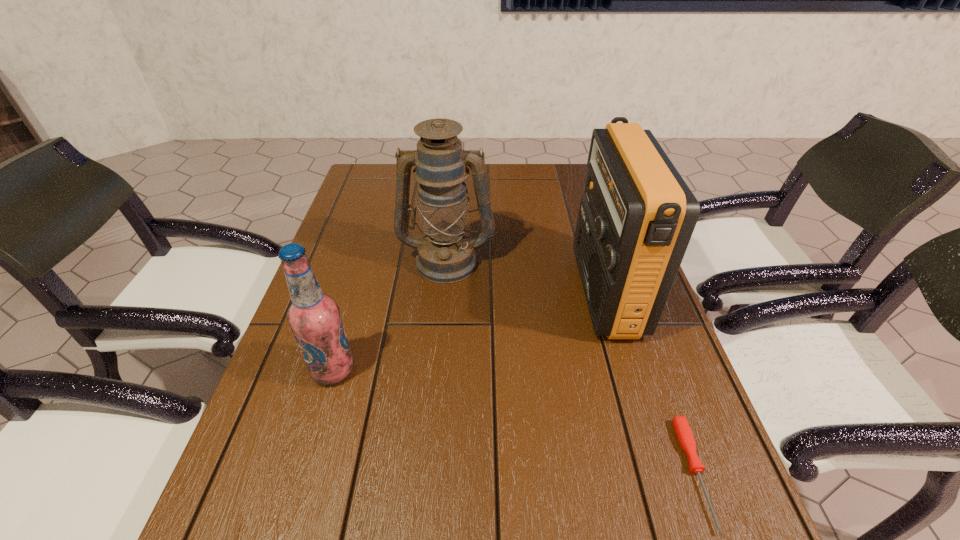
At what (x,y) coordinates should I click in order to perform the action: click on empty space that is in between the shortest object and the radio receiver. Please return your answer as a coordinate pair (x, y). Looking at the image, I should click on (650, 382).

Find the location of a particular element. The image size is (960, 540). free spot between the radio receiver and the nearest object is located at coordinates (650, 382).

The height and width of the screenshot is (540, 960). I want to click on vacant area that lies between the third object from right to left and the second nearest object, so click(x=390, y=315).

The width and height of the screenshot is (960, 540). What are the coordinates of `unoccupied area between the leftmost object and the radio receiver` in the screenshot? It's located at (469, 331).

Find the location of a particular element. free space that is in between the nearest object and the radio receiver is located at coordinates (650, 382).

Find the location of a particular element. Image resolution: width=960 pixels, height=540 pixels. empty space between the third farthest object and the radio receiver is located at coordinates (469, 331).

This screenshot has width=960, height=540. In order to click on vacant region between the second shortest object and the nearest object in this screenshot , I will do `click(515, 422)`.

At what (x,y) coordinates should I click in order to perform the action: click on vacant space in between the radio receiver and the alcohol. Please return your answer as a coordinate pair (x, y). Image resolution: width=960 pixels, height=540 pixels. Looking at the image, I should click on (469, 331).

Locate an element on the screen. Image resolution: width=960 pixels, height=540 pixels. vacant space that is in between the oil lamp and the leftmost object is located at coordinates (390, 315).

You are a GUI agent. You are given a task and a screenshot of the screen. Output one action in this format:
    pyautogui.click(x=<x>, y=<y>)
    Task: Click on the free space that is in between the radio receiver and the third tallest object
    
    Given the screenshot: What is the action you would take?
    pyautogui.click(x=469, y=331)